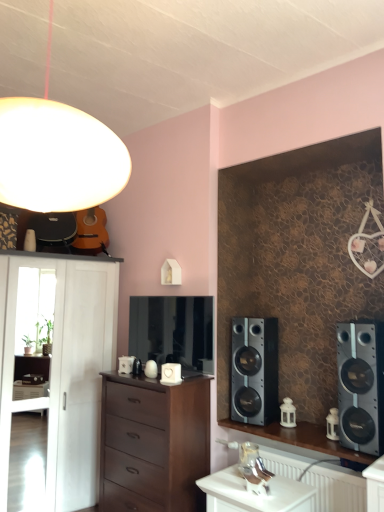
Question: Is satin silver speaker at right, acting as the second speaker starting from the right, inside the boundaries of white matte cabinet at left, or outside?

Choices:
 (A) inside
 (B) outside

Answer: (B)

Question: From the image's perspective, relative to white matte cabinet at left, is satin silver speaker at right, arranged as the second speaker when viewed from the front, above or below?

Choices:
 (A) above
 (B) below

Answer: (A)

Question: Considering the real-world distances, which object is farthest from the satin silver speaker at right, positioned as the 2th speaker in back-to-front order?

Choices:
 (A) white porcelain lantern at center
 (B) matte white globe at upper left
 (C) white glossy table at lower center
 (D) white matte cabinet at left
 (E) wooden desk at right

Answer: (D)

Question: Based on their relative distances, which object is farther from the wooden desk at right?

Choices:
 (A) white matte cabinet at left
 (B) matte white globe at upper left
 (C) white porcelain lantern at center
 (D) satin silver speaker at right, acting as the first speaker starting from the right
 (E) white glossy table at lower center

Answer: (B)